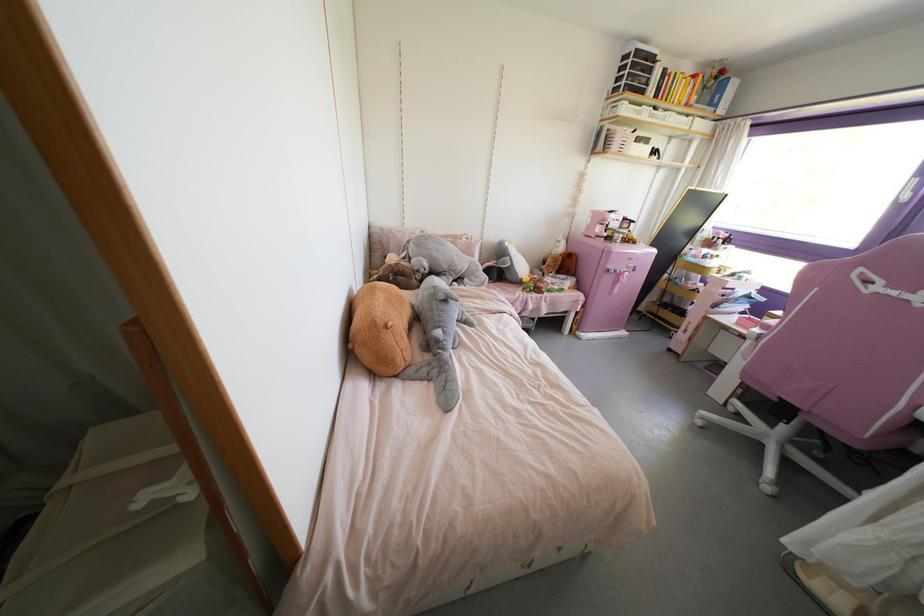
Where would you push the pink appliance lever? Please return your answer as a coordinate pair (x, y).

(621, 276)